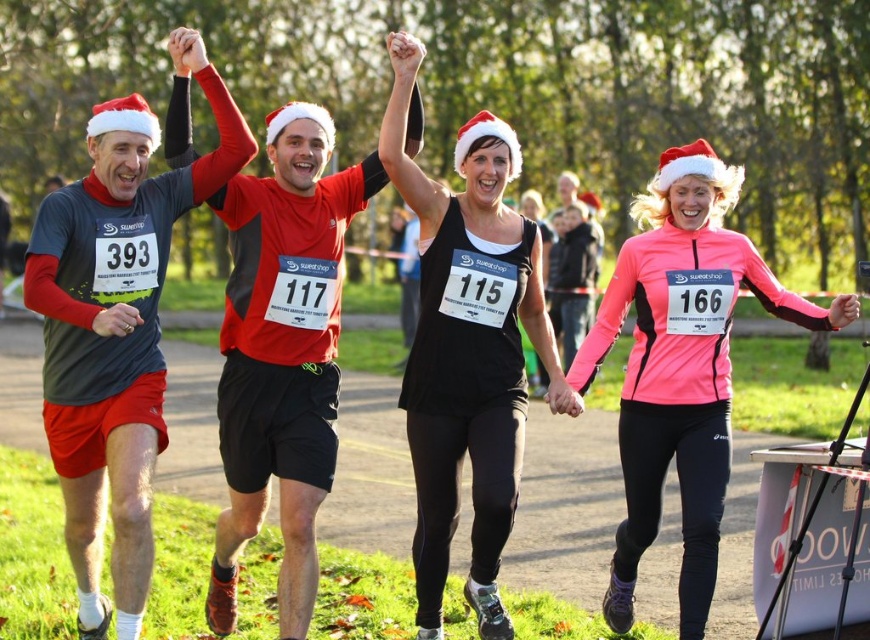
Is red matte jersey at center positioned at the back of pink matte jacket at center?

No, it is not.

Which is above, red matte jersey at center or pink matte jacket at center?

red matte jersey at center is above.

Is point (335, 216) less distant than point (727, 468)?

No, it is not.

I want to click on red matte jersey at center, so click(282, 353).

Between matte gray shirt at center and pink matte jacket at center, which one appears on the right side from the viewer's perspective?

Positioned to the right is pink matte jacket at center.

Between matte gray shirt at center and pink matte jacket at center, which one has less height?

pink matte jacket at center

Is point (79, 531) more distant than point (653, 525)?

No.

The image size is (870, 640). I want to click on matte gray shirt at center, so point(116,330).

Measure the distance between matte gray shirt at center and black matte tank top at center.

They are 1.67 meters apart.

I want to click on matte gray shirt at center, so click(x=116, y=330).

Is point (126, 228) positioned behind point (509, 451)?

That is False.

Identify the location of matte gray shirt at center. This screenshot has height=640, width=870. (116, 330).